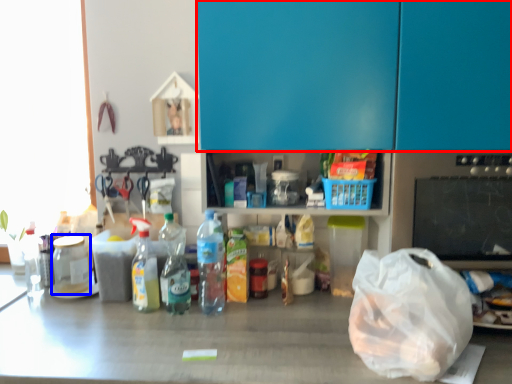
Question: Which of the following is the farthest to the observer, leftover (highlighted by a red box) or bottle (highlighted by a blue box)?

Choices:
 (A) leftover
 (B) bottle

Answer: (B)